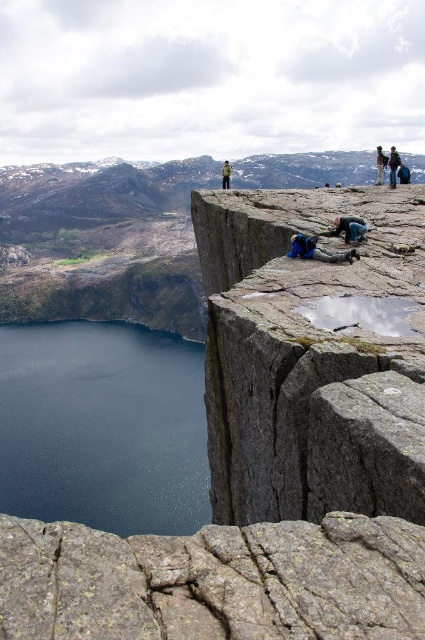
Question: Is gray rough rock at lower center thinner than green fabric jacket at center?

Choices:
 (A) yes
 (B) no

Answer: (B)

Question: Among these points, which one is farthest from the camera?

Choices:
 (A) (14, 404)
 (B) (227, 163)
 (C) (329, 193)

Answer: (A)

Question: In this image, where is gray rough rock at center located relative to dark blue water at lower left?

Choices:
 (A) right
 (B) left

Answer: (A)

Question: Is dark blue water at lower left positioned in front of green fabric jacket at center?

Choices:
 (A) yes
 (B) no

Answer: (B)

Question: Which is nearer to the gray rough rock at lower center?

Choices:
 (A) green fabric jacket at center
 (B) dark blue water at lower left

Answer: (A)

Question: Which object is farther from the camera taking this photo?

Choices:
 (A) gray rough rock at lower center
 (B) gray rough rock at center

Answer: (B)